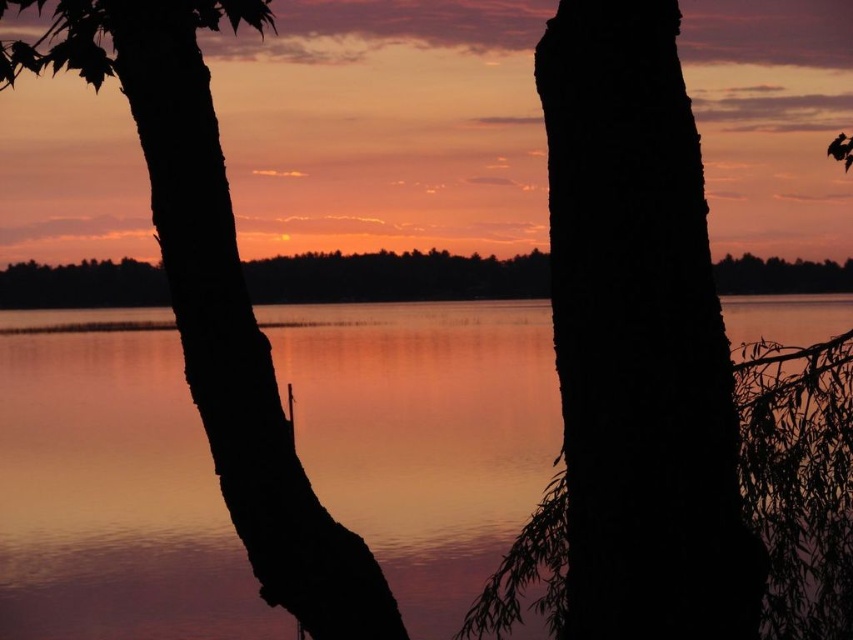
You are an artist trying to paint the sunset scene. You need to decide which object, the smooth water at center or the black matte tree trunk at left, should be painted taller in your artwork to match the actual scene. Which one should you make taller?

The smooth water at center has a greater height compared to the black matte tree trunk at left, so you should paint the smooth water at center taller than the black matte tree trunk at left to match the actual scene.

You are standing in the middle of the forest and see the black rough bark at center and the black matte tree trunk at left. Which tree is closer to you?

The black rough bark at center is closer to the viewer than the black matte tree trunk at left.